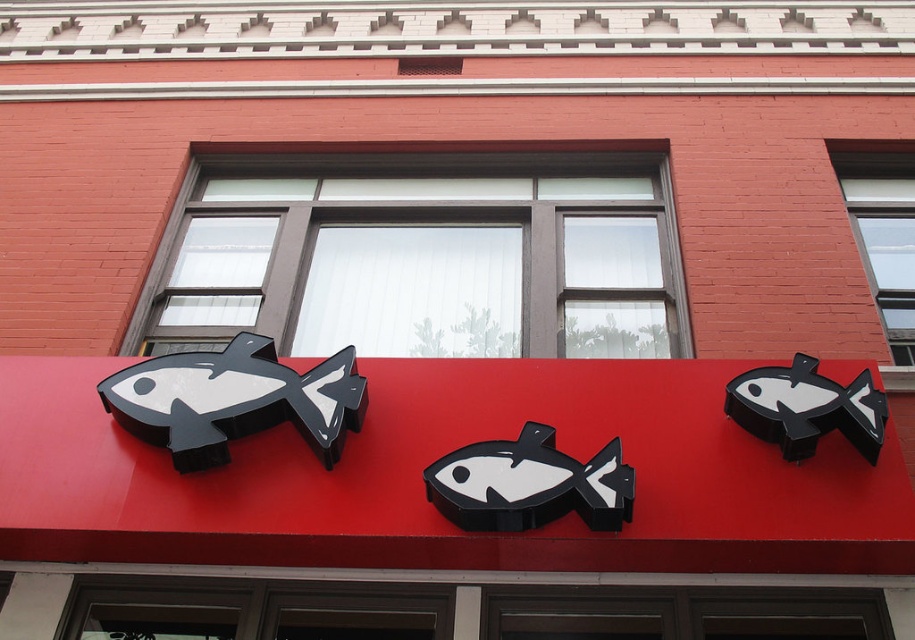
Question: Which point is closer to the camera?

Choices:
 (A) black matte fish at upper right
 (B) matte black fish at center
 (C) black matte fish at center

Answer: (C)

Question: Which point appears closest to the camera in this image?

Choices:
 (A) (447, 515)
 (B) (154, 401)
 (C) (838, 428)

Answer: (A)

Question: Considering the real-world distances, which object is closest to the black matte fish at upper right?

Choices:
 (A) black matte fish at center
 (B) matte black fish at center

Answer: (A)

Question: Is the position of matte black fish at center less distant than that of black matte fish at center?

Choices:
 (A) yes
 (B) no

Answer: (B)

Question: Does matte black fish at center appear on the left side of black matte fish at upper right?

Choices:
 (A) no
 (B) yes

Answer: (B)

Question: Can you confirm if matte black fish at center is positioned to the left of black matte fish at center?

Choices:
 (A) no
 (B) yes

Answer: (B)